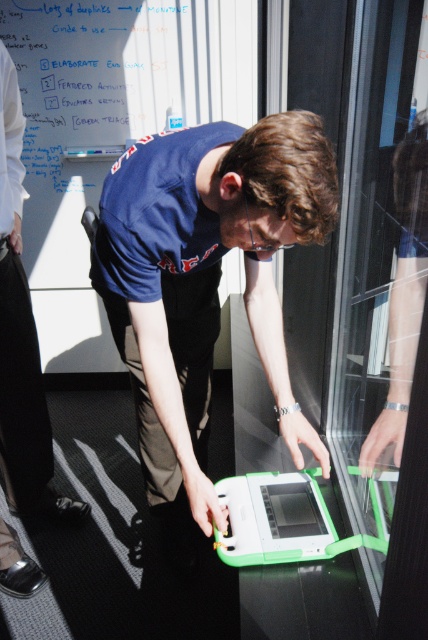
Question: Is green matte laptop at center further to camera compared to whiteboard at upper left?

Choices:
 (A) no
 (B) yes

Answer: (A)

Question: Among these objects, which one is nearest to the camera?

Choices:
 (A) green matte laptop at center
 (B) white cotton shirt at upper left
 (C) whiteboard at upper left

Answer: (A)

Question: Is green matte laptop at center in front of white cotton shirt at upper left?

Choices:
 (A) yes
 (B) no

Answer: (A)

Question: Which object is the closest to the whiteboard at upper left?

Choices:
 (A) green matte laptop at center
 (B) white cotton shirt at upper left

Answer: (B)

Question: Does green matte laptop at center lie in front of whiteboard at upper left?

Choices:
 (A) yes
 (B) no

Answer: (A)

Question: Which object appears closest to the camera in this image?

Choices:
 (A) white cotton shirt at upper left
 (B) whiteboard at upper left

Answer: (A)